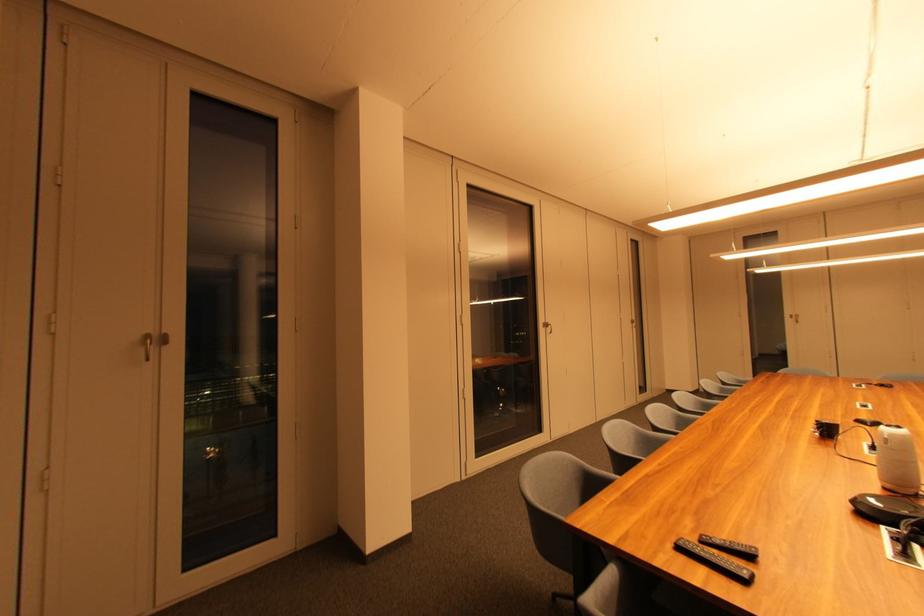
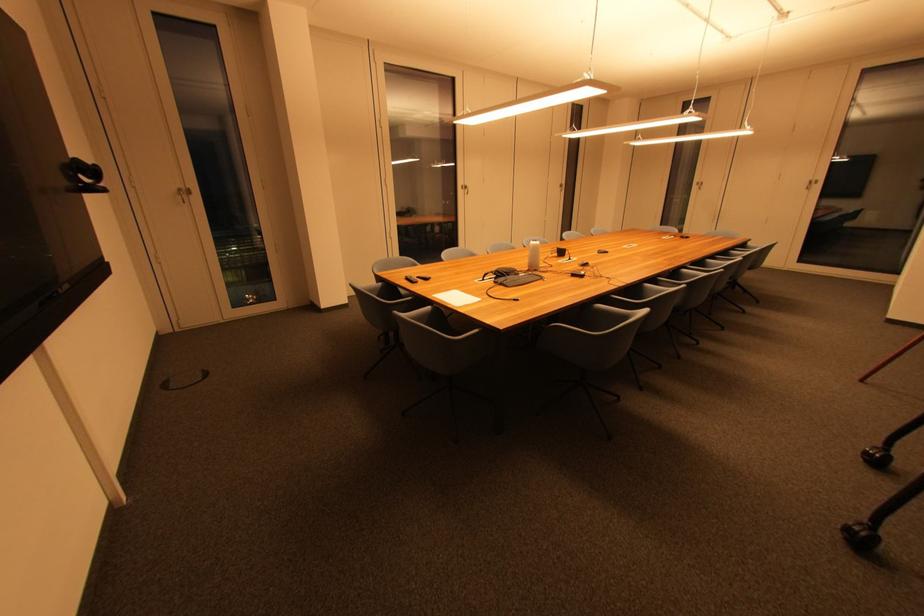
The point at (549, 329) is marked in the first image. Where is the corresponding point in the second image?

(468, 190)